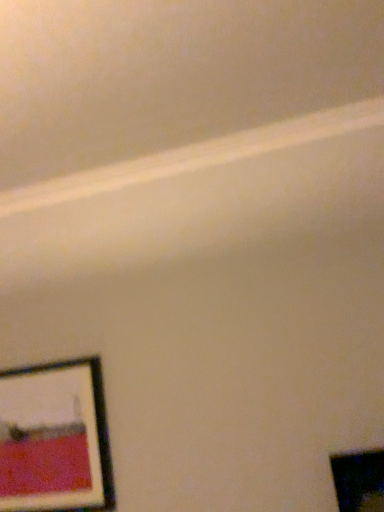
Where is `matte black picture frame at lower left`? Image resolution: width=384 pixels, height=512 pixels. matte black picture frame at lower left is located at coordinates (54, 439).

In order to face matte black picture frame at lower left, should I rotate leftwards or rightwards?

Rotate your view left by about 18.220°.

What is the approximate width of matte black picture frame at lower left?

matte black picture frame at lower left is 4.36 centimeters in width.

Describe the element at coordinates (54, 439) in the screenshot. I see `matte black picture frame at lower left` at that location.

This screenshot has height=512, width=384. What are the coordinates of `matte black picture frame at lower left` in the screenshot? It's located at pyautogui.click(x=54, y=439).